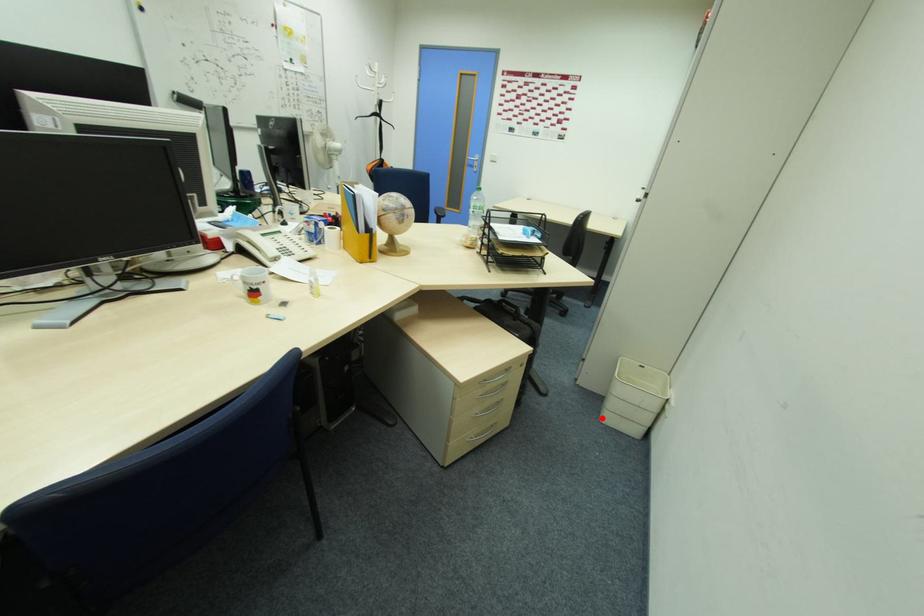
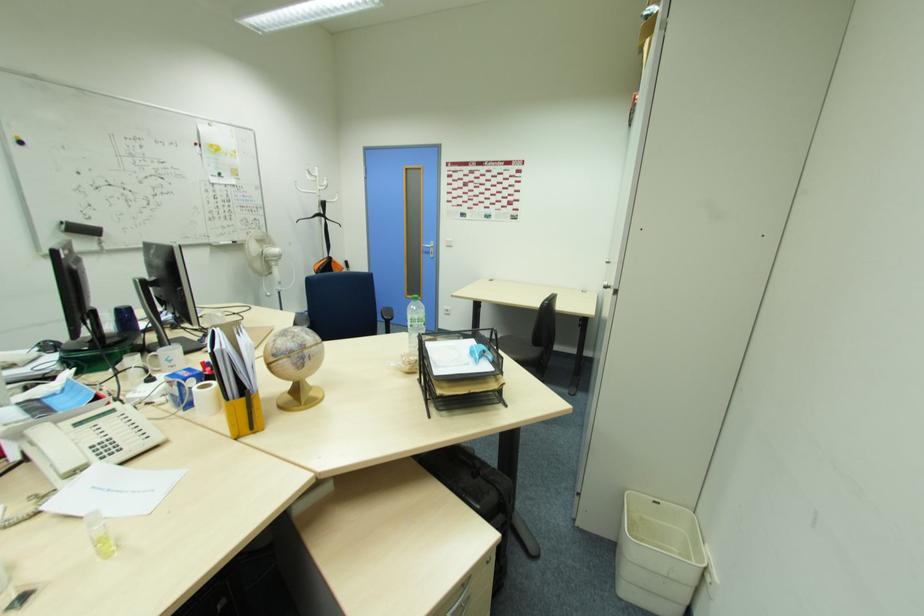
Where in the second image is the point corresponding to the highlighted location from the first image?

(618, 590)